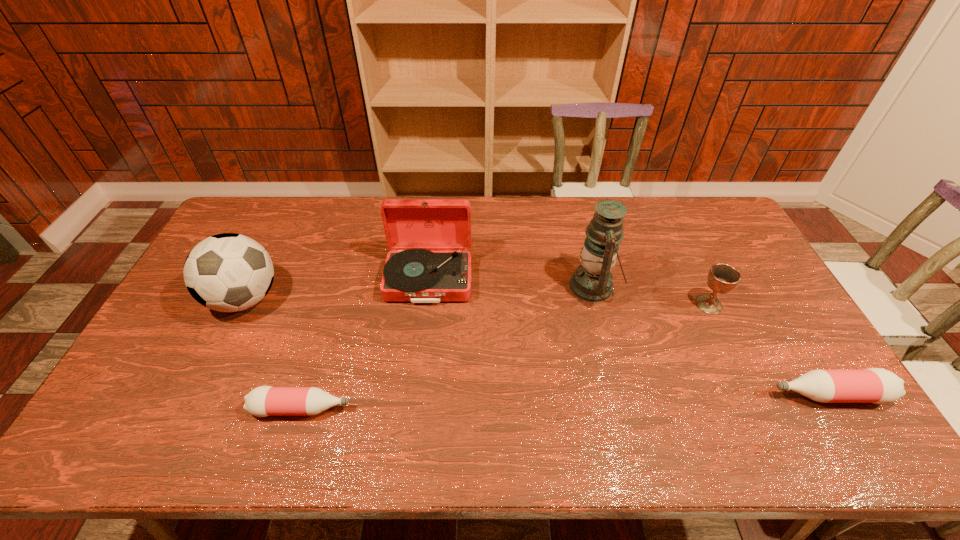
What are the coordinates of `vacant position for inserting another bottle evenly` in the screenshot? It's located at (568, 402).